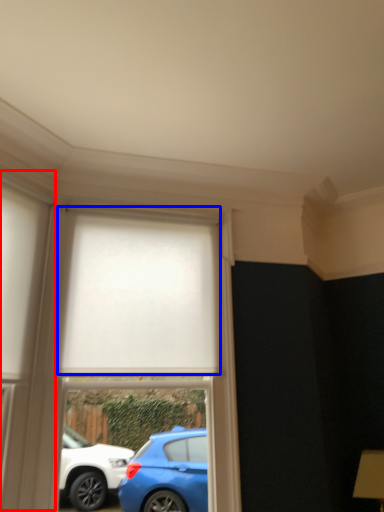
Question: Which object is closer to the camera taking this photo, glass door (highlighted by a red box) or curtain (highlighted by a blue box)?

Choices:
 (A) glass door
 (B) curtain

Answer: (A)